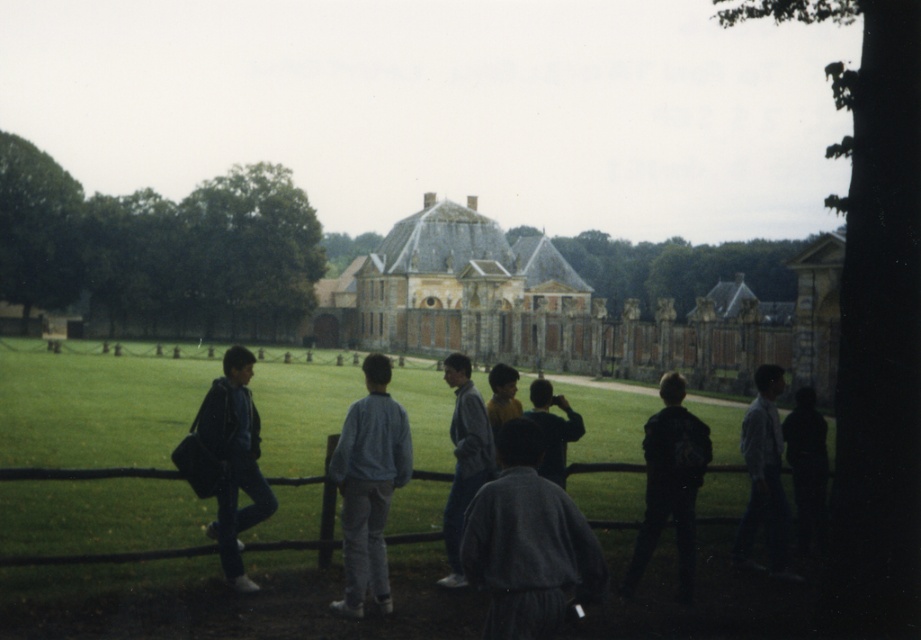
Question: Which of the following is the closest to the observer?

Choices:
 (A) (227, 456)
 (B) (805, 410)

Answer: (A)

Question: Which of the following is the farthest from the observer?

Choices:
 (A) black matte jacket at lower right
 (B) gray wool sweater at center

Answer: (A)

Question: In this image, where is light gray sweatshirt at center located relative to gray fleece jacket at center?

Choices:
 (A) right
 (B) left

Answer: (B)

Question: Can you confirm if yellow stone palace at center is bigger than dark blue jacket at left?

Choices:
 (A) yes
 (B) no

Answer: (A)

Question: Is yellow stone palace at center to the right of light blue shirt at center from the viewer's perspective?

Choices:
 (A) yes
 (B) no

Answer: (A)

Question: Estimate the real-world distances between objects in this image. Which object is farther from the black matte jacket at lower right?

Choices:
 (A) yellow stone palace at center
 (B) gray wool sweater at center

Answer: (A)